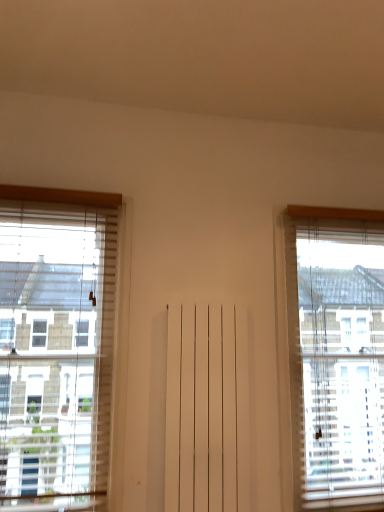
Image resolution: width=384 pixels, height=512 pixels. What do you see at coordinates (332, 360) in the screenshot?
I see `translucent wood window at right, the 1th window from the right` at bounding box center [332, 360].

The height and width of the screenshot is (512, 384). Find the location of `translucent wood window at right, the 1th window from the right`. translucent wood window at right, the 1th window from the right is located at coordinates (332, 360).

This screenshot has width=384, height=512. I want to click on white wooden window at left, positioned as the 2th window in right-to-left order, so click(56, 346).

How much space does white wooden window at left, positioned as the 2th window in right-to-left order, occupy horizontally?

14.92 centimeters.

The width and height of the screenshot is (384, 512). What do you see at coordinates (56, 346) in the screenshot?
I see `white wooden window at left, positioned as the 2th window in right-to-left order` at bounding box center [56, 346].

This screenshot has width=384, height=512. In order to click on translucent wood window at right, which ranks as the 2th window in left-to-right order in this screenshot , I will do `click(332, 360)`.

Which object is positioned more to the right, translucent wood window at right, which ranks as the 2th window in left-to-right order, or white wooden window at left, acting as the 1th window starting from the left?

From the viewer's perspective, translucent wood window at right, which ranks as the 2th window in left-to-right order, appears more on the right side.

Based on the photo, which object is more forward, translucent wood window at right, which ranks as the 2th window in left-to-right order, or white wooden window at left, acting as the 1th window starting from the left?

white wooden window at left, acting as the 1th window starting from the left.

Between point (382, 236) and point (63, 386), which one is positioned behind?

Positioned behind is point (382, 236).

From the image's perspective, relative to white wooden window at left, acting as the 1th window starting from the left, is translucent wood window at right, which ranks as the 2th window in left-to-right order, above or below?

Based on their image positions, translucent wood window at right, which ranks as the 2th window in left-to-right order, is located beneath white wooden window at left, acting as the 1th window starting from the left.

From a real-world perspective, is translucent wood window at right, which ranks as the 2th window in left-to-right order, beneath white wooden window at left, positioned as the 2th window in right-to-left order?

Yes, from a real-world perspective, translucent wood window at right, which ranks as the 2th window in left-to-right order, is below white wooden window at left, positioned as the 2th window in right-to-left order.

Which object is thinner, translucent wood window at right, which ranks as the 2th window in left-to-right order, or white wooden window at left, acting as the 1th window starting from the left?

Thinner between the two is white wooden window at left, acting as the 1th window starting from the left.

In terms of height, does translucent wood window at right, which ranks as the 2th window in left-to-right order, look taller or shorter compared to white wooden window at left, positioned as the 2th window in right-to-left order?

Clearly, translucent wood window at right, which ranks as the 2th window in left-to-right order, is taller compared to white wooden window at left, positioned as the 2th window in right-to-left order.

Who is smaller, translucent wood window at right, which ranks as the 2th window in left-to-right order, or white wooden window at left, positioned as the 2th window in right-to-left order?

white wooden window at left, positioned as the 2th window in right-to-left order, is smaller.

Would you say translucent wood window at right, the 1th window from the right, contains white wooden window at left, acting as the 1th window starting from the left?

No, white wooden window at left, acting as the 1th window starting from the left, is not a part of translucent wood window at right, the 1th window from the right.

Does translucent wood window at right, the 1th window from the right, touch white wooden window at left, positioned as the 2th window in right-to-left order?

No, translucent wood window at right, the 1th window from the right, is not in contact with white wooden window at left, positioned as the 2th window in right-to-left order.

Is translucent wood window at right, which ranks as the 2th window in left-to-right order, looking in the opposite direction of white wooden window at left, positioned as the 2th window in right-to-left order?

That's not correct — translucent wood window at right, which ranks as the 2th window in left-to-right order, is not looking away from white wooden window at left, positioned as the 2th window in right-to-left order.

What's the angular difference between translucent wood window at right, the 1th window from the right, and white wooden window at left, acting as the 1th window starting from the left,'s facing directions?

The facing directions of translucent wood window at right, the 1th window from the right, and white wooden window at left, acting as the 1th window starting from the left, are 0.00609 degrees apart.

How far apart are translucent wood window at right, the 1th window from the right, and white wooden window at left, acting as the 1th window starting from the left?

A distance of 4.04 feet exists between translucent wood window at right, the 1th window from the right, and white wooden window at left, acting as the 1th window starting from the left.

This screenshot has height=512, width=384. I want to click on window above the translucent wood window at right, which ranks as the 2th window in left-to-right order (from the image's perspective), so click(56, 346).

Between white wooden window at left, positioned as the 2th window in right-to-left order, and translucent wood window at right, the 1th window from the right, which one appears on the right side from the viewer's perspective?

From the viewer's perspective, translucent wood window at right, the 1th window from the right, appears more on the right side.

Is white wooden window at left, positioned as the 2th window in right-to-left order, in front of translucent wood window at right, the 1th window from the right?

Yes, it is in front of translucent wood window at right, the 1th window from the right.

Is point (34, 226) more distant than point (361, 504)?

No, it is not.

From the image's perspective, is white wooden window at left, positioned as the 2th window in right-to-left order, under translucent wood window at right, the 1th window from the right?

Actually, white wooden window at left, positioned as the 2th window in right-to-left order, appears above translucent wood window at right, the 1th window from the right, in the image.

From a real-world perspective, who is located lower, white wooden window at left, positioned as the 2th window in right-to-left order, or translucent wood window at right, the 1th window from the right?

translucent wood window at right, the 1th window from the right, is physically lower.

Based on the photo, does white wooden window at left, positioned as the 2th window in right-to-left order, have a lesser width compared to translucent wood window at right, the 1th window from the right?

Yes.

Consider the image. In terms of height, does white wooden window at left, acting as the 1th window starting from the left, look taller or shorter compared to translucent wood window at right, which ranks as the 2th window in left-to-right order?

In the image, white wooden window at left, acting as the 1th window starting from the left, appears to be shorter than translucent wood window at right, which ranks as the 2th window in left-to-right order.

Considering the sizes of white wooden window at left, positioned as the 2th window in right-to-left order, and translucent wood window at right, the 1th window from the right, in the image, is white wooden window at left, positioned as the 2th window in right-to-left order, bigger or smaller than translucent wood window at right, the 1th window from the right,?

Considering their sizes, white wooden window at left, positioned as the 2th window in right-to-left order, takes up less space than translucent wood window at right, the 1th window from the right.

Is white wooden window at left, positioned as the 2th window in right-to-left order, not inside translucent wood window at right, the 1th window from the right?

white wooden window at left, positioned as the 2th window in right-to-left order, lies outside translucent wood window at right, the 1th window from the right,'s area.

Is white wooden window at left, acting as the 1th window starting from the left, far away from translucent wood window at right, the 1th window from the right?

white wooden window at left, acting as the 1th window starting from the left, is positioned a significant distance from translucent wood window at right, the 1th window from the right.

Is white wooden window at left, acting as the 1th window starting from the left, looking in the opposite direction of translucent wood window at right, the 1th window from the right?

No, translucent wood window at right, the 1th window from the right, is not at the back of white wooden window at left, acting as the 1th window starting from the left.

What's the angular difference between white wooden window at left, acting as the 1th window starting from the left, and translucent wood window at right, the 1th window from the right,'s facing directions?

white wooden window at left, acting as the 1th window starting from the left, and translucent wood window at right, the 1th window from the right, are facing 0.00609 degrees away from each other.

This screenshot has width=384, height=512. I want to click on window in front of the translucent wood window at right, which ranks as the 2th window in left-to-right order, so click(56, 346).

Image resolution: width=384 pixels, height=512 pixels. I want to click on window behind the white wooden window at left, positioned as the 2th window in right-to-left order, so click(x=332, y=360).

Identify the location of window on the left of translucent wood window at right, which ranks as the 2th window in left-to-right order. Image resolution: width=384 pixels, height=512 pixels. (56, 346).